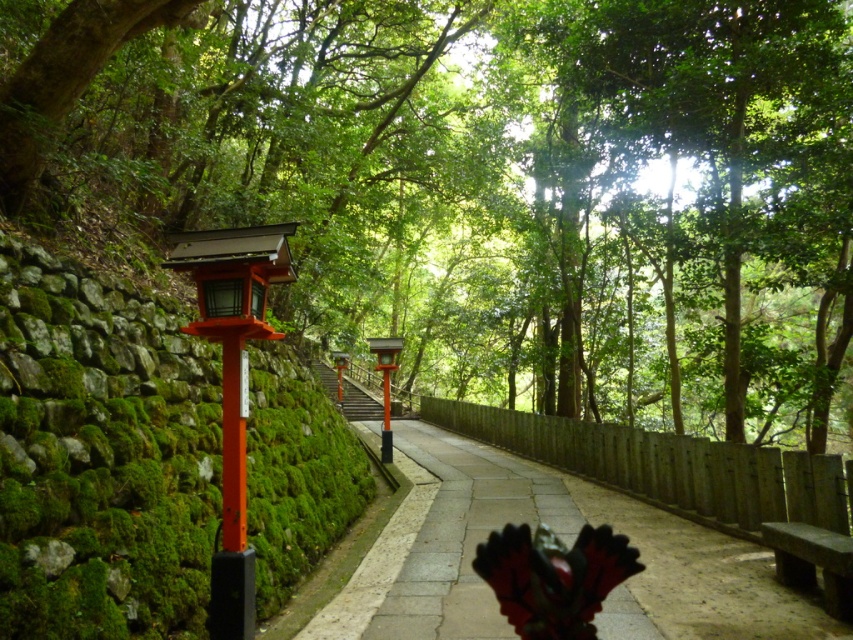
Does green leafy tree at center appear over dark gray stone bench at lower right?

Correct, green leafy tree at center is located above dark gray stone bench at lower right.

Does green leafy tree at center have a lesser width compared to dark gray stone bench at lower right?

Incorrect, green leafy tree at center's width is not less than dark gray stone bench at lower right's.

At what (x,y) coordinates should I click in order to perform the action: click on green leafy tree at center. Please return your answer as a coordinate pair (x, y). Looking at the image, I should click on (479, 180).